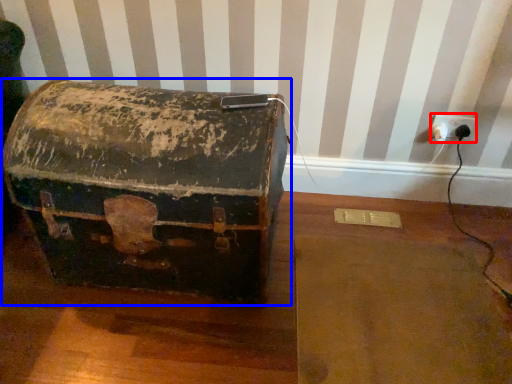
Question: Which object appears closest to the camera in this image, electric outlet (highlighted by a red box) or box (highlighted by a blue box)?

Choices:
 (A) electric outlet
 (B) box

Answer: (B)